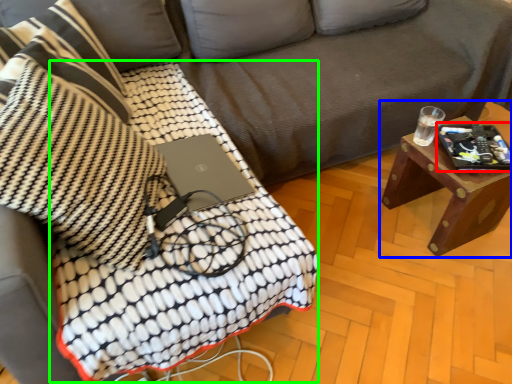
Question: Based on their relative distances, which object is farther from tablet computer (highlighted by a red box)? Choose from table (highlighted by a blue box) and blanket (highlighted by a green box).

Choices:
 (A) table
 (B) blanket

Answer: (B)